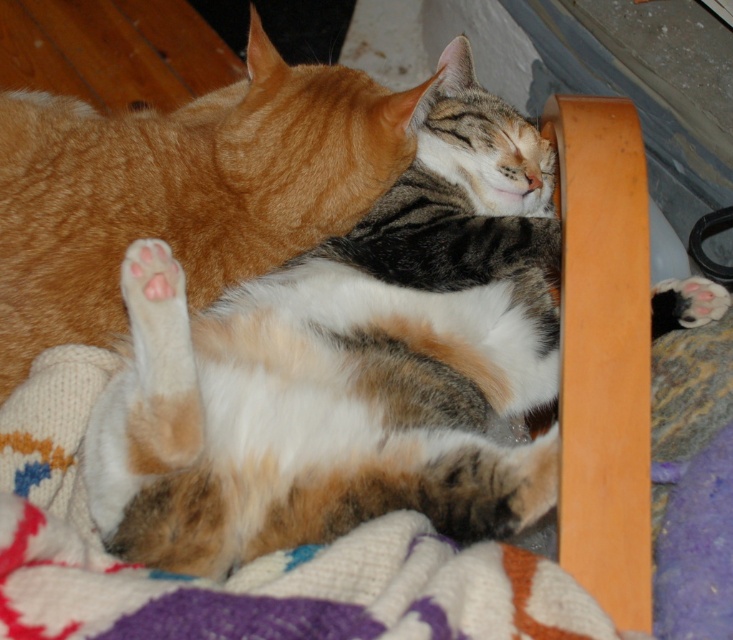
You are a photographer trying to capture a closeup of the orange tabby cat at upper center and the white fur paw at lower right. Which object should you focus on first if you want to ensure both are in focus?

The orange tabby cat at upper center is positioned on the left side of white fur paw at lower right. To ensure both are in focus, you should focus on the orange tabby cat at upper center first since it is closer to the camera than the white fur paw at lower right.